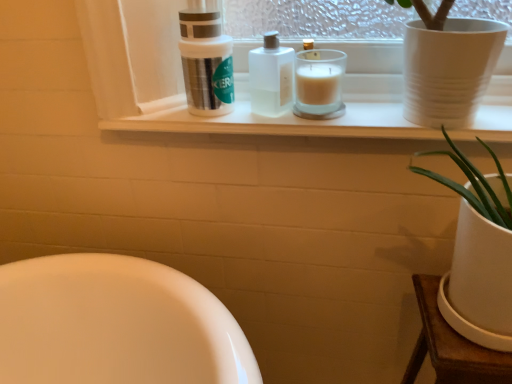
Question: Can you confirm if translucent glass candle at center is positioned to the right of silver metallic container at upper center?

Choices:
 (A) yes
 (B) no

Answer: (A)

Question: Can you confirm if translucent glass candle at center is positioned to the left of silver metallic container at upper center?

Choices:
 (A) no
 (B) yes

Answer: (A)

Question: Is translucent glass candle at center shorter than silver metallic container at upper center?

Choices:
 (A) yes
 (B) no

Answer: (A)

Question: Is translucent glass candle at center next to silver metallic container at upper center and touching it?

Choices:
 (A) yes
 (B) no

Answer: (B)

Question: Is translucent glass candle at center further to camera compared to silver metallic container at upper center?

Choices:
 (A) no
 (B) yes

Answer: (B)

Question: Does translucent glass candle at center turn towards silver metallic container at upper center?

Choices:
 (A) no
 (B) yes

Answer: (A)

Question: Does silver metallic container at upper center have a lesser height compared to clear plastic bottle at center?

Choices:
 (A) no
 (B) yes

Answer: (A)

Question: Does silver metallic container at upper center have a smaller size compared to clear plastic bottle at center?

Choices:
 (A) yes
 (B) no

Answer: (B)

Question: Is silver metallic container at upper center facing towards clear plastic bottle at center?

Choices:
 (A) no
 (B) yes

Answer: (A)

Question: Does silver metallic container at upper center have a larger size compared to clear plastic bottle at center?

Choices:
 (A) yes
 (B) no

Answer: (A)

Question: Is silver metallic container at upper center positioned beyond the bounds of clear plastic bottle at center?

Choices:
 (A) no
 (B) yes

Answer: (B)

Question: Is silver metallic container at upper center at the left side of clear plastic bottle at center?

Choices:
 (A) yes
 (B) no

Answer: (A)

Question: Is translucent glass candle at center touching white matte window sill at upper center?

Choices:
 (A) yes
 (B) no

Answer: (B)